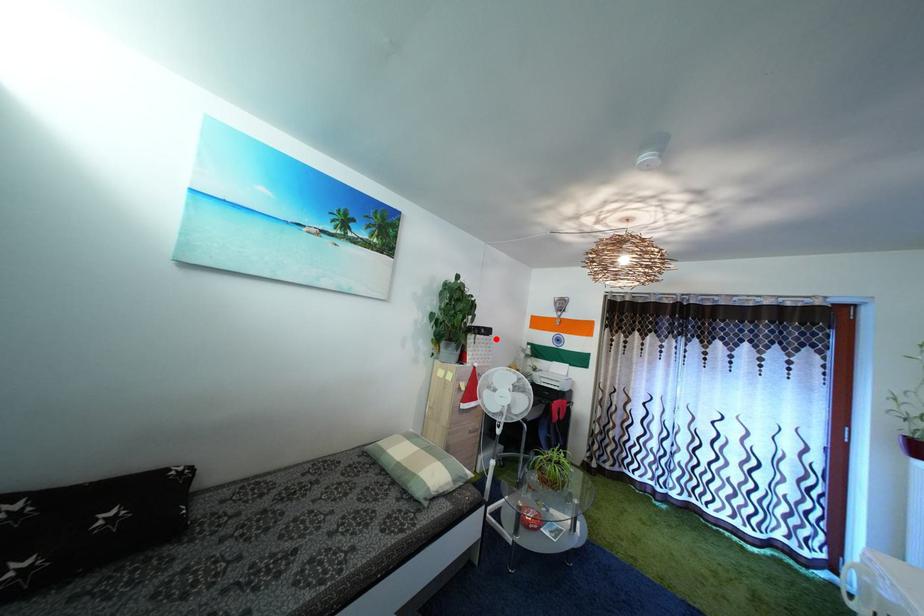
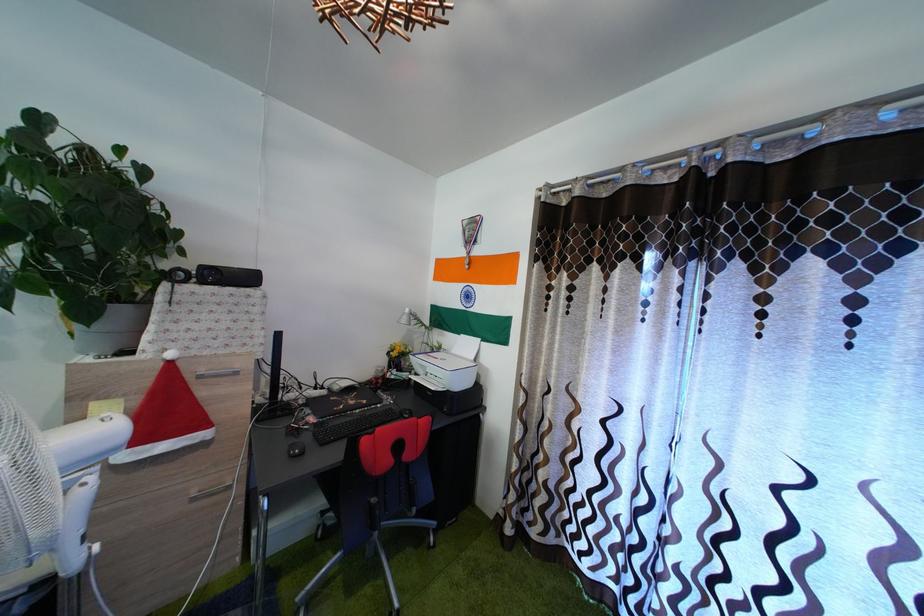
Locate, in the second image, the point that corresponds to the highlighted location in the first image.

(257, 286)